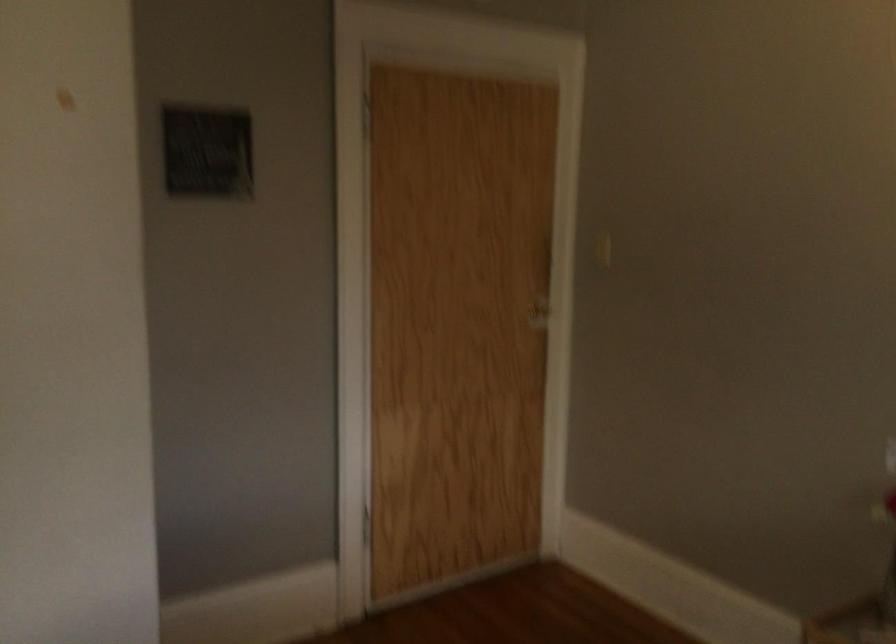
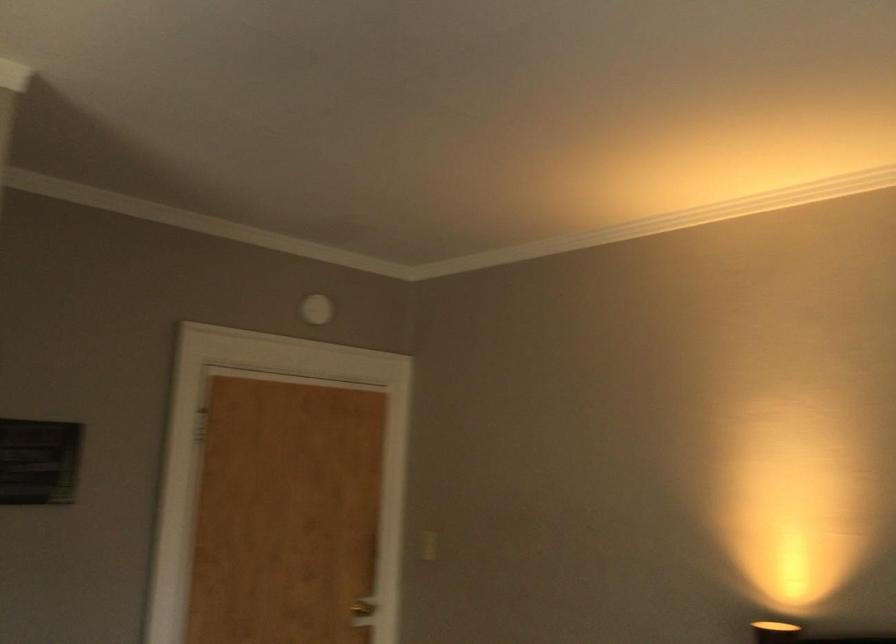
Question: Based on the continuous images, in which direction is the camera rotating? Reply with the corresponding letter.

Choices:
 (A) Left
 (B) Right
 (C) Up
 (D) Down

Answer: (C)